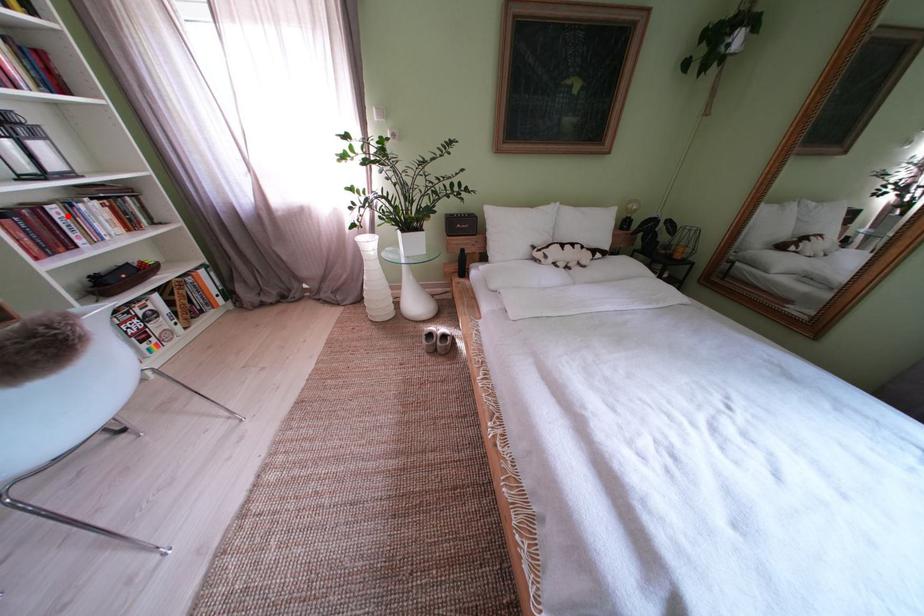
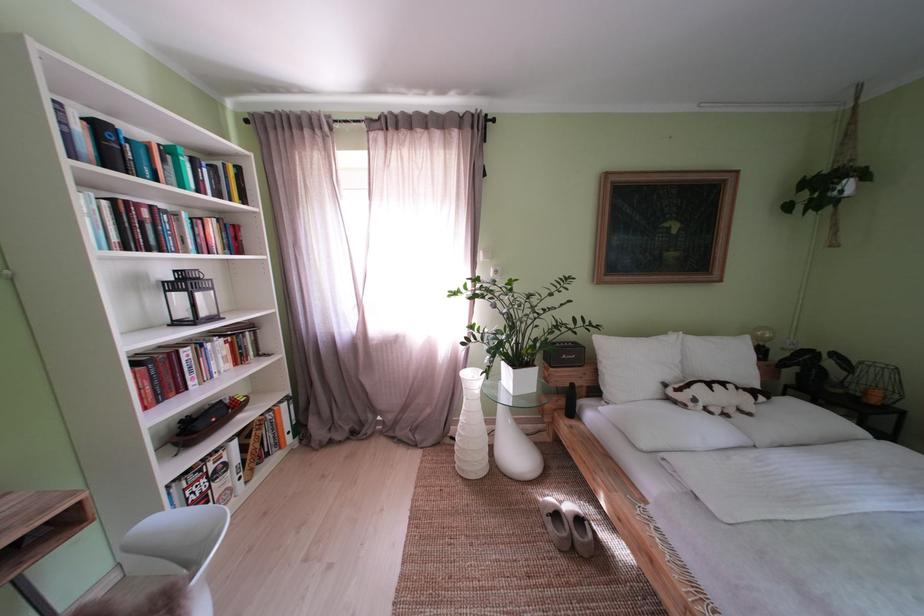
Question: I am providing you with two images of the same scene from different viewpoints. Image1 has a red point marked. In image2, the corresponding 3D location appears at what relative position? Reply with the corresponding letter.

Choices:
 (A) Closer
 (B) Farther

Answer: (A)